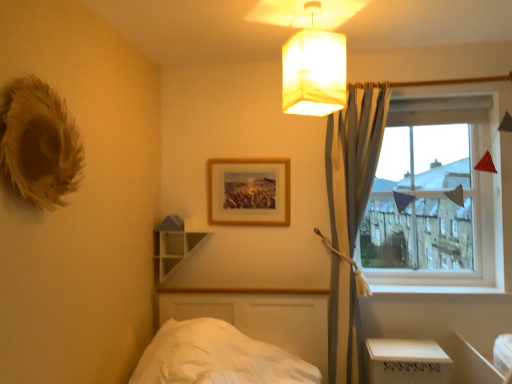
Question: Is green matte shelf at upper center directly adjacent to clear glass window at right?

Choices:
 (A) no
 (B) yes

Answer: (A)

Question: Is green matte shelf at upper center not within clear glass window at right?

Choices:
 (A) no
 (B) yes

Answer: (B)

Question: Can you confirm if green matte shelf at upper center is thinner than clear glass window at right?

Choices:
 (A) no
 (B) yes

Answer: (A)

Question: Does green matte shelf at upper center have a smaller size compared to clear glass window at right?

Choices:
 (A) no
 (B) yes

Answer: (B)

Question: Can clear glass window at right be found inside green matte shelf at upper center?

Choices:
 (A) yes
 (B) no

Answer: (B)

Question: Considering the relative positions of wooden picture frame at upper center and green matte shelf at upper center in the image provided, is wooden picture frame at upper center to the left or to the right of green matte shelf at upper center?

Choices:
 (A) left
 (B) right

Answer: (B)

Question: Considering the positions of point (244, 167) and point (189, 246), is point (244, 167) closer or farther from the camera than point (189, 246)?

Choices:
 (A) farther
 (B) closer

Answer: (B)

Question: Is wooden picture frame at upper center taller or shorter than green matte shelf at upper center?

Choices:
 (A) short
 (B) tall

Answer: (B)

Question: Is wooden picture frame at upper center inside or outside of green matte shelf at upper center?

Choices:
 (A) outside
 (B) inside

Answer: (A)

Question: In terms of width, does white plastic table at lower right look wider or thinner when compared to wooden picture frame at upper center?

Choices:
 (A) wide
 (B) thin

Answer: (A)

Question: Is point (378, 364) closer or farther from the camera than point (225, 208)?

Choices:
 (A) farther
 (B) closer

Answer: (B)

Question: Is white plastic table at lower right inside or outside of wooden picture frame at upper center?

Choices:
 (A) outside
 (B) inside

Answer: (A)

Question: Looking at the image, does white plastic table at lower right seem bigger or smaller compared to wooden picture frame at upper center?

Choices:
 (A) big
 (B) small

Answer: (A)

Question: Relative to white plastic table at lower right, is clear glass window at right in front or behind?

Choices:
 (A) front
 (B) behind

Answer: (B)

Question: From the image's perspective, is clear glass window at right positioned above or below white plastic table at lower right?

Choices:
 (A) above
 (B) below

Answer: (A)